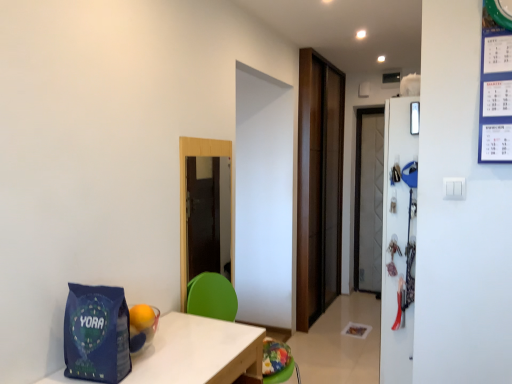
Identify the location of vacant area that lies to the right of brown wood door at center. (353, 311).